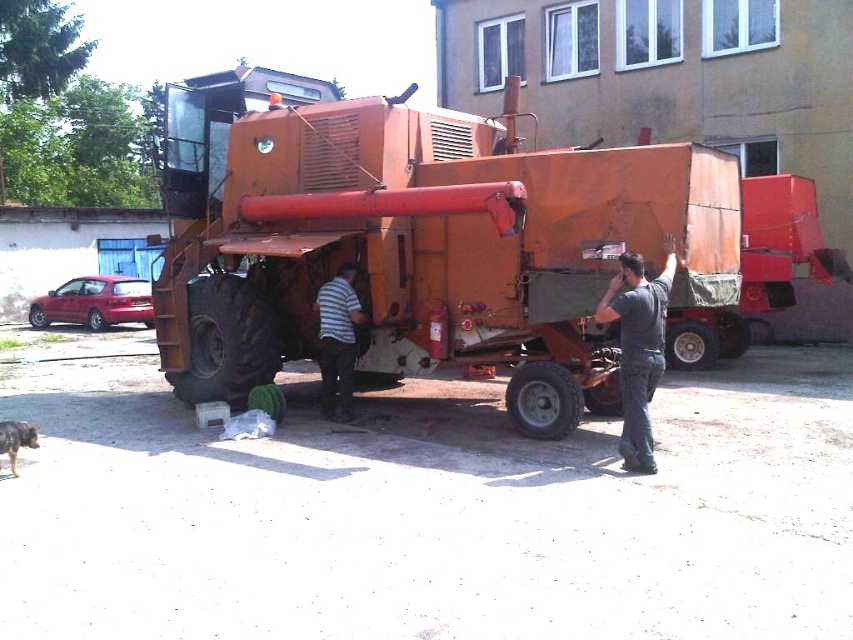
Is dark gray shirt at center to the left of striped shirt at center from the viewer's perspective?

In fact, dark gray shirt at center is to the right of striped shirt at center.

This screenshot has width=853, height=640. Find the location of `dark gray shirt at center`. dark gray shirt at center is located at coordinates (637, 348).

Who is shorter, rusty metal tractor at center or dark gray shirt at center?

Standing shorter between the two is rusty metal tractor at center.

Is rusty metal tractor at center taller than dark gray shirt at center?

In fact, rusty metal tractor at center may be shorter than dark gray shirt at center.

Between point (257, 264) and point (618, 310), which one is positioned in front?

Positioned in front is point (618, 310).

This screenshot has width=853, height=640. I want to click on rusty metal tractor at center, so click(415, 241).

Can you confirm if rusty metal tractor at center is positioned to the left of striped shirt at center?

Yes, rusty metal tractor at center is to the left of striped shirt at center.

Which is below, rusty metal tractor at center or striped shirt at center?

striped shirt at center is below.

Which is in front, point (567, 422) or point (347, 387)?

Point (567, 422) is in front.

Identify the location of rusty metal tractor at center. (415, 241).